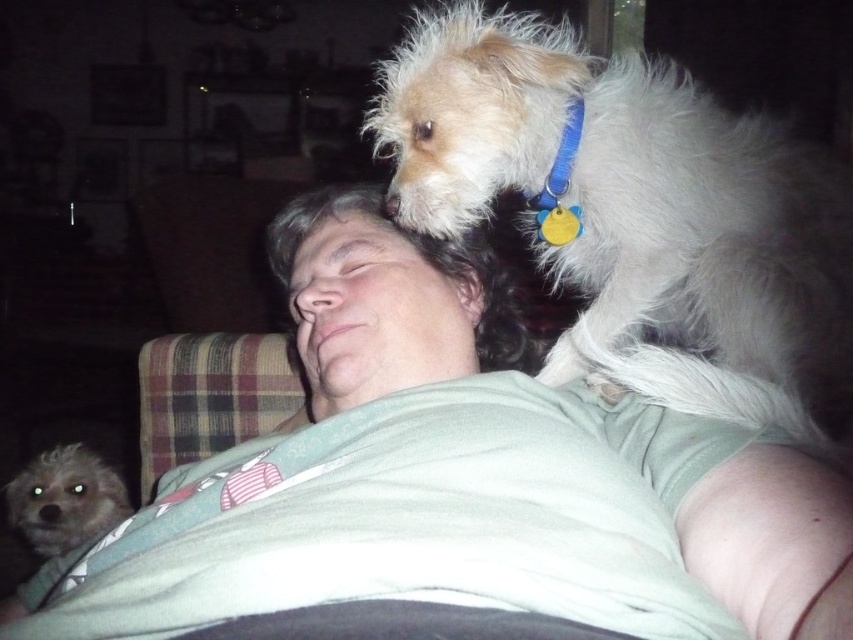
Where is the white fur dog at upper center located in the image?

The white fur dog at upper center is located at point (456, 484) in the image.